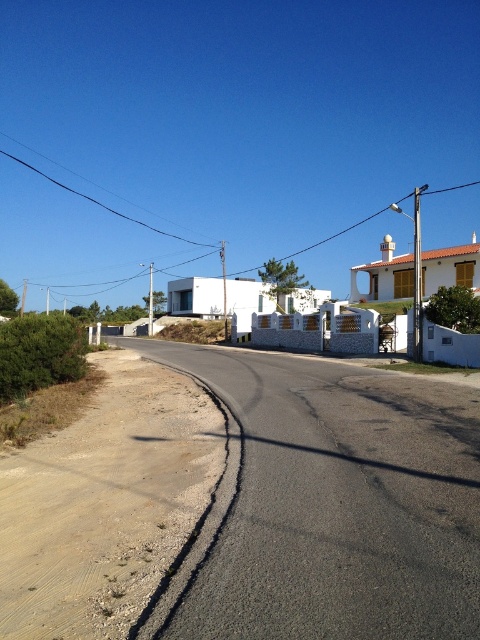
Between asphalt road at lower left and asphalt road at center, which one is positioned lower?

asphalt road at center is lower down.

Between point (409, 378) and point (169, 582), which one is positioned behind?

The point (409, 378) is behind.

Does point (312, 392) lie behind point (207, 504)?

Yes, it is.

I want to click on asphalt road at lower left, so click(337, 502).